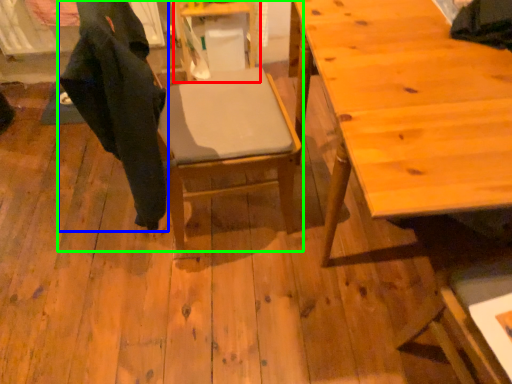
Question: Which object is positioned closest to table (highlighted by a red box)? Select from robe (highlighted by a blue box) and chair (highlighted by a green box).

Choices:
 (A) robe
 (B) chair

Answer: (B)